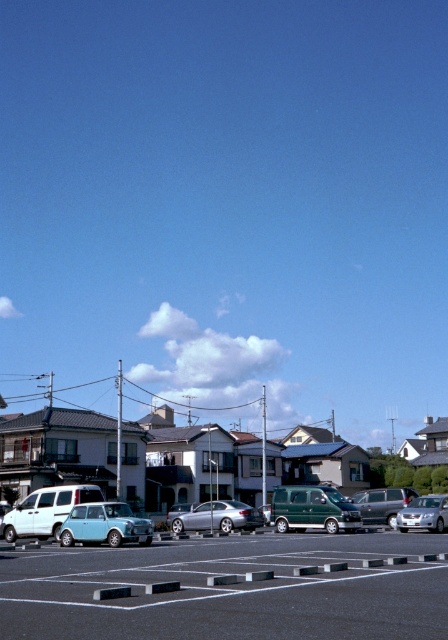
You are a delivery person trying to park your 5.5 meter long delivery van in the parking lot. The black asphalt parking lot at lower center has spaces that are 5.5 meters long. Can your van fit in one of these spaces?

The parking spaces in the black asphalt parking lot at lower center are 11.91 meters apart, so yes, the delivery van can fit in one of these spaces since they are longer than the van.

You are a delivery person trying to park your 1.5 meter tall delivery box in the parking lot. The box needs to be placed between the light blue matte car at lower left and the metallic silver sedan at center. Can the delivery box fit vertically between them?

The light blue matte car at lower left has a lesser height compared to metallic silver sedan at center. Since the delivery box is 1.5 meters tall, it can fit vertically between them as the height difference allows enough space.

You are a delivery driver who needs to park your vehicle in the black asphalt parking lot at lower center. However, there is a satin silver sedan at center already occupying the space. Based on the scene description, can you park your vehicle in the parking lot without overlapping the sedan?

The black asphalt parking lot at lower center is located above the satin silver sedan at center, meaning the sedan is parked underneath the parking lot. Since the parking lot is above the sedan, there is space to park your vehicle in the parking lot without overlapping it.